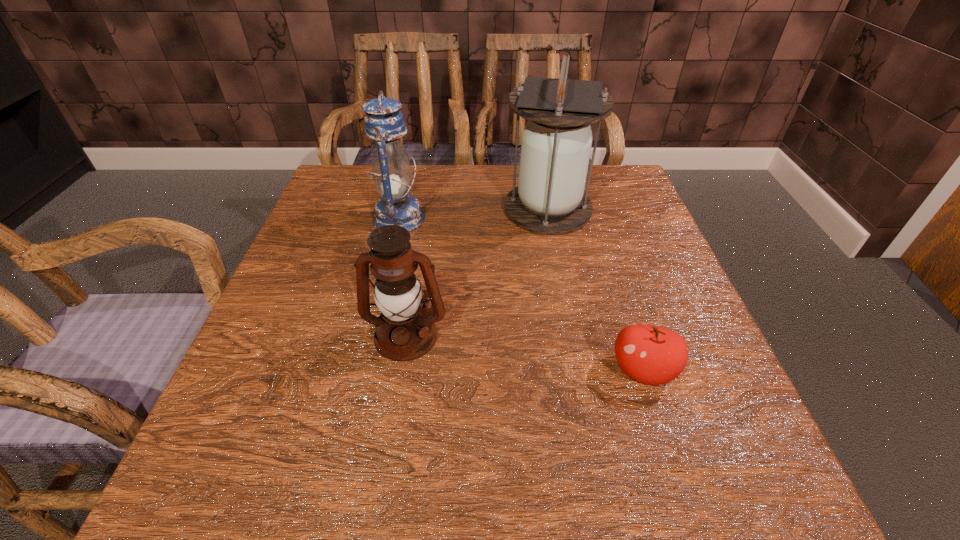
The width and height of the screenshot is (960, 540). Identify the location of vacant space in between the shortest object and the rightmost lantern. (595, 290).

Where is `vacant area that lies between the shortest object and the rightmost lantern`? This screenshot has height=540, width=960. vacant area that lies between the shortest object and the rightmost lantern is located at coordinates click(595, 290).

Image resolution: width=960 pixels, height=540 pixels. Find the location of `object that can be found as the third closest to the nearest lantern`. object that can be found as the third closest to the nearest lantern is located at coordinates (653, 355).

Where is `object that stands as the second closest to the rightmost lantern`? Image resolution: width=960 pixels, height=540 pixels. object that stands as the second closest to the rightmost lantern is located at coordinates (405, 331).

Identify which lantern is the closest to the nearest lantern. Please provide its 2D coordinates. Your answer should be formatted as a tuple, i.e. [(x, y)], where the tuple contains the x and y coordinates of a point satisfying the conditions above.

[(384, 124)]

Choose which lantern is the nearest neighbor to the apple. Please provide its 2D coordinates. Your answer should be formatted as a tuple, i.e. [(x, y)], where the tuple contains the x and y coordinates of a point satisfying the conditions above.

[(405, 331)]

Locate an element on the screen. This screenshot has width=960, height=540. vacant area in the image that satisfies the following two spatial constraints: 1. on the side of the shortest object, there is a wick adjustment knob; 2. on the left side of the nearest lantern is located at coordinates (400, 371).

What are the coordinates of `free space that satisfies the following two spatial constraints: 1. on the side of the nearest lantern, there is a wick adjustment knob; 2. on the left side of the shortest object` in the screenshot? It's located at (400, 371).

Find the location of `free space that satisfies the following two spatial constraints: 1. on the side of the apple, there is a wick adjustment knob; 2. on the right side of the nearest lantern`. free space that satisfies the following two spatial constraints: 1. on the side of the apple, there is a wick adjustment knob; 2. on the right side of the nearest lantern is located at coordinates (400, 371).